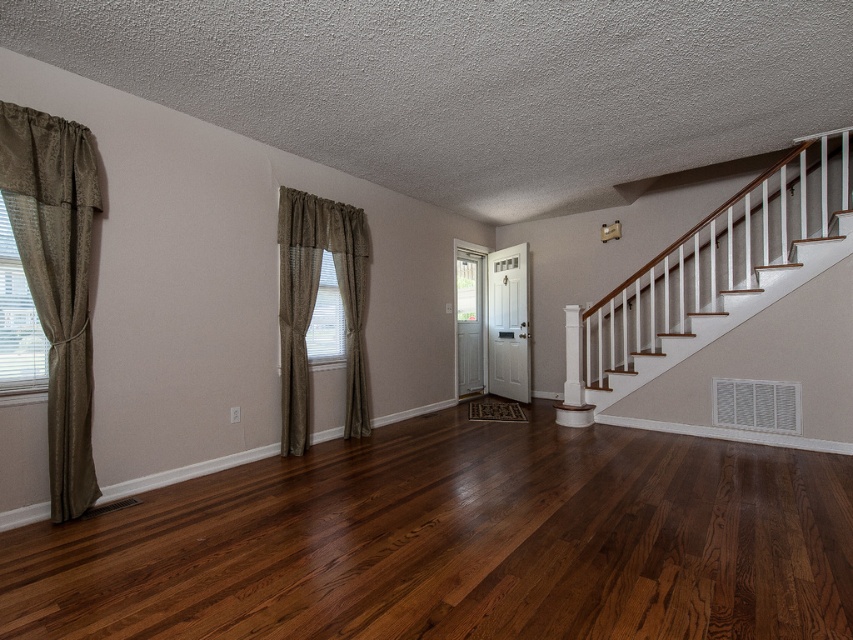
You are standing at the entrance of the living room and want to place a small potted plant exactly where the dark brown wood floor at center is located. According to the coordinates provided, where should you place the plant?

The dark brown wood floor at center is located at point (459, 541), so you should place the plant at those coordinates.

You are planning to install a new ceiling fan in the living room. The installation requires a minimum clearance of 2.5 meters between the fan and the nearest obstruction. Given the white textured blinds at left and the white glossy column at center, which object is closer to the ceiling and would need to be considered for fan placement?

The white textured blinds at left has a lesser height compared to the white glossy column at center, meaning the blinds are closer to the ceiling. Therefore, the white textured blinds at left would be the obstruction to consider for the ceiling fan installation clearance.